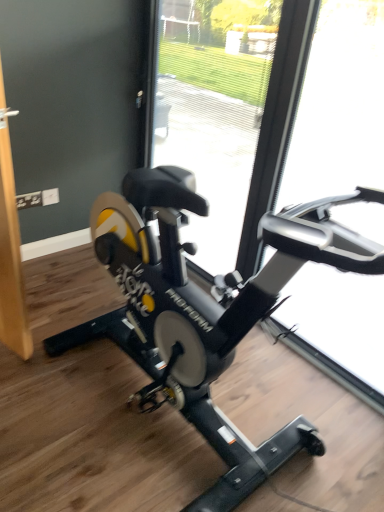
Question: Can you confirm if transparent glass door at right, which is the second glass door from left to right, is positioned to the left of transparent glass door at center, which is the 2th glass door in right-to-left order?

Choices:
 (A) no
 (B) yes

Answer: (A)

Question: Are transparent glass door at right, which appears as the first glass door when viewed from the right, and transparent glass door at center, which ranks as the 1th glass door in left-to-right order, beside each other?

Choices:
 (A) yes
 (B) no

Answer: (B)

Question: Can you confirm if transparent glass door at right, which is the second glass door from left to right, is taller than transparent glass door at center, which ranks as the 1th glass door in left-to-right order?

Choices:
 (A) no
 (B) yes

Answer: (B)

Question: Is transparent glass door at right, which appears as the first glass door when viewed from the right, positioned before transparent glass door at center, which is the 2th glass door in right-to-left order?

Choices:
 (A) no
 (B) yes

Answer: (B)

Question: From the image's perspective, is transparent glass door at right, which is the second glass door from left to right, located above transparent glass door at center, which ranks as the 1th glass door in left-to-right order?

Choices:
 (A) no
 (B) yes

Answer: (A)

Question: Does transparent glass door at right, which appears as the first glass door when viewed from the right, have a lesser height compared to transparent glass door at center, which is the 2th glass door in right-to-left order?

Choices:
 (A) no
 (B) yes

Answer: (A)

Question: Does black matte stationary bicycle at center have a greater height compared to transparent glass door at right, which is the second glass door from left to right?

Choices:
 (A) yes
 (B) no

Answer: (B)

Question: Is black matte stationary bicycle at center far from transparent glass door at right, which is the second glass door from left to right?

Choices:
 (A) no
 (B) yes

Answer: (A)

Question: Is transparent glass door at right, which appears as the first glass door when viewed from the right, located within black matte stationary bicycle at center?

Choices:
 (A) no
 (B) yes

Answer: (A)

Question: From the image's perspective, is black matte stationary bicycle at center under transparent glass door at right, which appears as the first glass door when viewed from the right?

Choices:
 (A) yes
 (B) no

Answer: (A)

Question: From a real-world perspective, is black matte stationary bicycle at center on top of transparent glass door at right, which is the second glass door from left to right?

Choices:
 (A) yes
 (B) no

Answer: (B)

Question: Considering the relative positions of black matte stationary bicycle at center and transparent glass door at right, which appears as the first glass door when viewed from the right, in the image provided, is black matte stationary bicycle at center to the left of transparent glass door at right, which appears as the first glass door when viewed from the right, from the viewer's perspective?

Choices:
 (A) no
 (B) yes

Answer: (B)

Question: Would you consider black matte stationary bicycle at center to be distant from transparent glass door at center, which is the 2th glass door in right-to-left order?

Choices:
 (A) no
 (B) yes

Answer: (A)